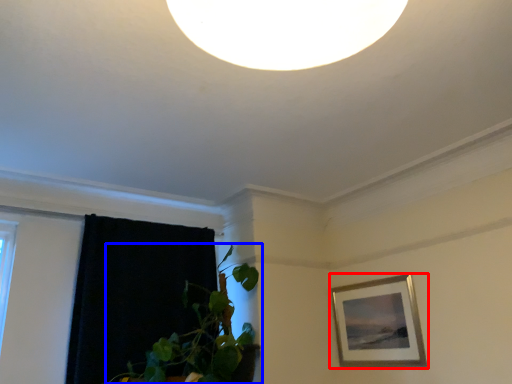
Question: Which point is closer to the camera, picture frame (highlighted by a red box) or houseplant (highlighted by a blue box)?

Choices:
 (A) picture frame
 (B) houseplant

Answer: (B)